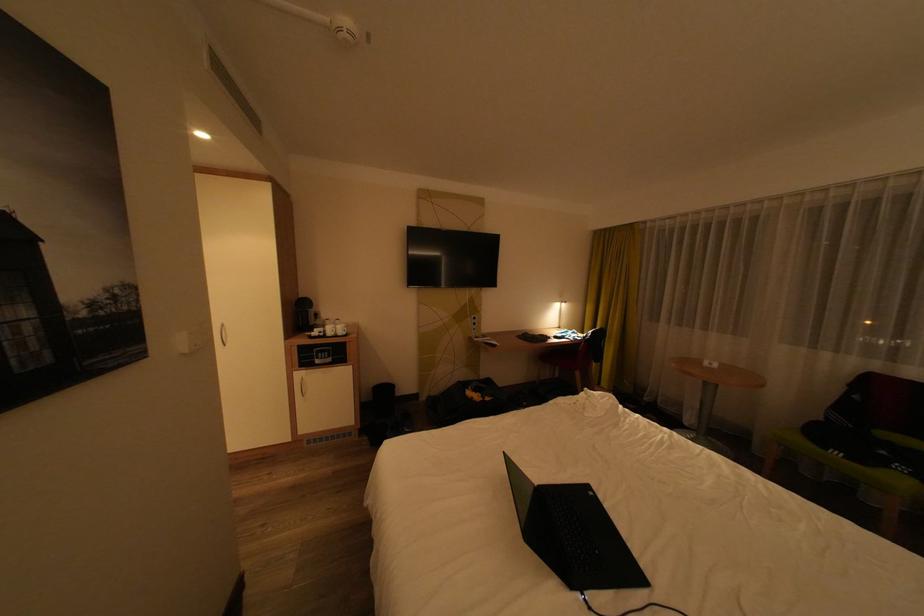
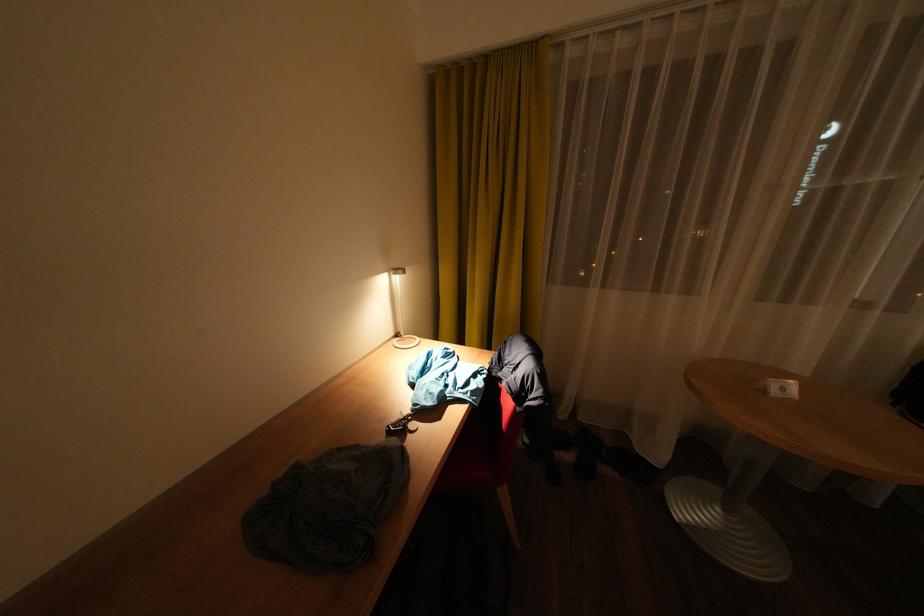
The point at (569, 328) is marked in the first image. Where is the corresponding point in the second image?

(407, 336)